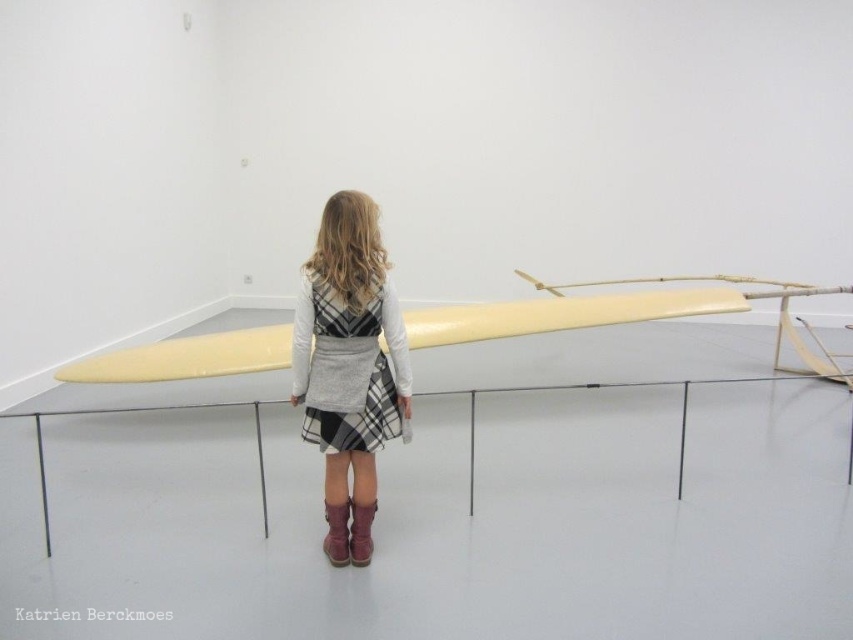
Is plaid fabric dress at center to the left of matte yellow surfboard at center from the viewer's perspective?

Yes, plaid fabric dress at center is to the left of matte yellow surfboard at center.

Between plaid fabric dress at center and matte yellow surfboard at center, which one has less height?

With less height is matte yellow surfboard at center.

Find the location of a particular element. plaid fabric dress at center is located at coordinates (349, 348).

This screenshot has height=640, width=853. What do you see at coordinates (349, 348) in the screenshot?
I see `plaid fabric dress at center` at bounding box center [349, 348].

Who is more distant from viewer, (317, 372) or (369, 506)?

Positioned behind is point (369, 506).

Between point (389, 321) and point (369, 525), which one is positioned behind?

The point (369, 525) is behind.

Identify the location of plaid fabric dress at center. (349, 348).

Does matte yellow surfboard at center have a lesser width compared to brown suede boot at lower center?

In fact, matte yellow surfboard at center might be wider than brown suede boot at lower center.

Between matte yellow surfboard at center and brown suede boot at lower center, which one has more height?

matte yellow surfboard at center

Between point (677, 291) and point (354, 564), which one is positioned behind?

Positioned behind is point (677, 291).

Find the location of a particular element. This screenshot has width=853, height=640. matte yellow surfboard at center is located at coordinates (561, 314).